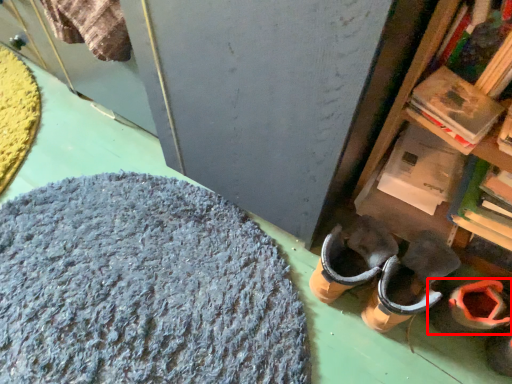
Question: From the image's perspective, what is the correct spatial positioning of footwear (annotated by the red box) in reference to wool?

Choices:
 (A) below
 (B) above

Answer: (A)